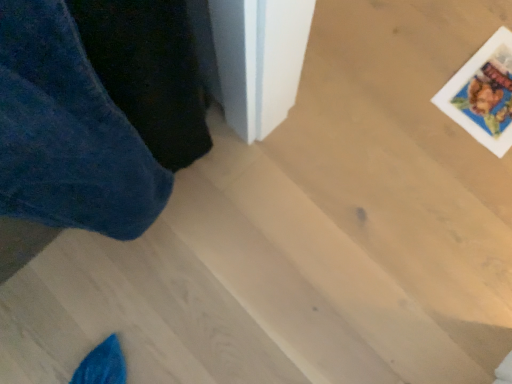
Question: Is velvety blue trousers at left not within printed paper postcard at upper right?

Choices:
 (A) yes
 (B) no

Answer: (A)

Question: Is the surface of velvety blue trousers at left in direct contact with printed paper postcard at upper right?

Choices:
 (A) no
 (B) yes

Answer: (A)

Question: Is the position of velvety blue trousers at left more distant than that of printed paper postcard at upper right?

Choices:
 (A) no
 (B) yes

Answer: (A)

Question: From a real-world perspective, is velvety blue trousers at left below printed paper postcard at upper right?

Choices:
 (A) no
 (B) yes

Answer: (A)

Question: Considering the relative sizes of velvety blue trousers at left and printed paper postcard at upper right in the image provided, is velvety blue trousers at left thinner than printed paper postcard at upper right?

Choices:
 (A) yes
 (B) no

Answer: (A)

Question: Can you confirm if velvety blue trousers at left is positioned to the left of printed paper postcard at upper right?

Choices:
 (A) yes
 (B) no

Answer: (A)

Question: Is printed paper postcard at upper right facing away from velvety blue trousers at left?

Choices:
 (A) no
 (B) yes

Answer: (A)

Question: Can you confirm if printed paper postcard at upper right is smaller than velvety blue trousers at left?

Choices:
 (A) no
 (B) yes

Answer: (B)

Question: Is printed paper postcard at upper right facing towards velvety blue trousers at left?

Choices:
 (A) no
 (B) yes

Answer: (A)

Question: Is printed paper postcard at upper right bigger than velvety blue trousers at left?

Choices:
 (A) yes
 (B) no

Answer: (B)

Question: Does printed paper postcard at upper right have a lesser width compared to velvety blue trousers at left?

Choices:
 (A) yes
 (B) no

Answer: (B)

Question: Is velvety blue trousers at left inside printed paper postcard at upper right?

Choices:
 (A) yes
 (B) no

Answer: (B)

Question: From a real-world perspective, is printed paper postcard at upper right above or below velvety blue trousers at left?

Choices:
 (A) below
 (B) above

Answer: (A)